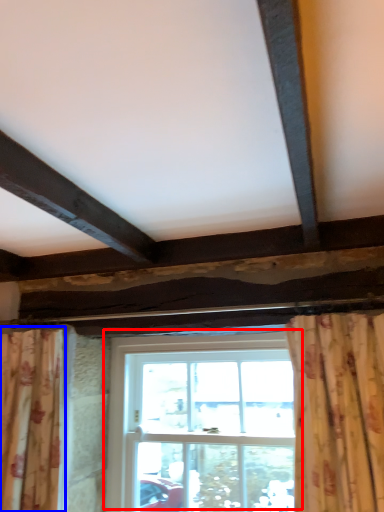
Question: Which of the following is the farthest to the observer, window (highlighted by a red box) or curtain (highlighted by a blue box)?

Choices:
 (A) window
 (B) curtain

Answer: (A)